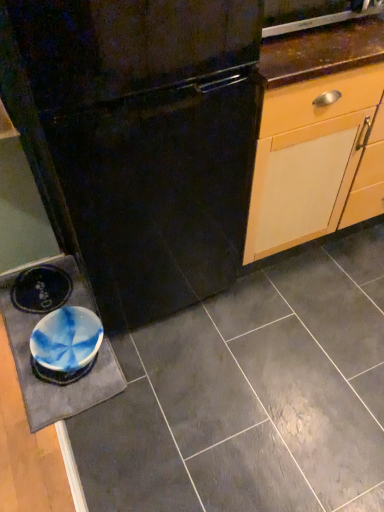
Question: From a real-world perspective, is black matte refrigerator at center on blue marbled slate at lower left?

Choices:
 (A) no
 (B) yes

Answer: (B)

Question: Is black matte refrigerator at center further to camera compared to blue marbled slate at lower left?

Choices:
 (A) no
 (B) yes

Answer: (A)

Question: Does black matte refrigerator at center have a smaller size compared to blue marbled slate at lower left?

Choices:
 (A) no
 (B) yes

Answer: (A)

Question: Does black matte refrigerator at center have a greater width compared to blue marbled slate at lower left?

Choices:
 (A) no
 (B) yes

Answer: (B)

Question: Considering the relative positions of black matte refrigerator at center and blue marbled slate at lower left in the image provided, is black matte refrigerator at center to the right of blue marbled slate at lower left from the viewer's perspective?

Choices:
 (A) no
 (B) yes

Answer: (B)

Question: Is black matte refrigerator at center in front of blue marbled slate at lower left?

Choices:
 (A) no
 (B) yes

Answer: (B)

Question: From the image's perspective, is matte ceramic tile at center over black matte refrigerator at center?

Choices:
 (A) no
 (B) yes

Answer: (A)

Question: Is matte ceramic tile at center oriented towards black matte refrigerator at center?

Choices:
 (A) no
 (B) yes

Answer: (A)

Question: Is matte ceramic tile at center closer to camera compared to black matte refrigerator at center?

Choices:
 (A) yes
 (B) no

Answer: (B)

Question: From a real-world perspective, is matte ceramic tile at center under black matte refrigerator at center?

Choices:
 (A) yes
 (B) no

Answer: (A)

Question: Can you confirm if matte ceramic tile at center is smaller than black matte refrigerator at center?

Choices:
 (A) no
 (B) yes

Answer: (B)

Question: Is matte ceramic tile at center thinner than black matte refrigerator at center?

Choices:
 (A) no
 (B) yes

Answer: (A)

Question: Is black matte refrigerator at center next to matte ceramic tile at center?

Choices:
 (A) yes
 (B) no

Answer: (B)